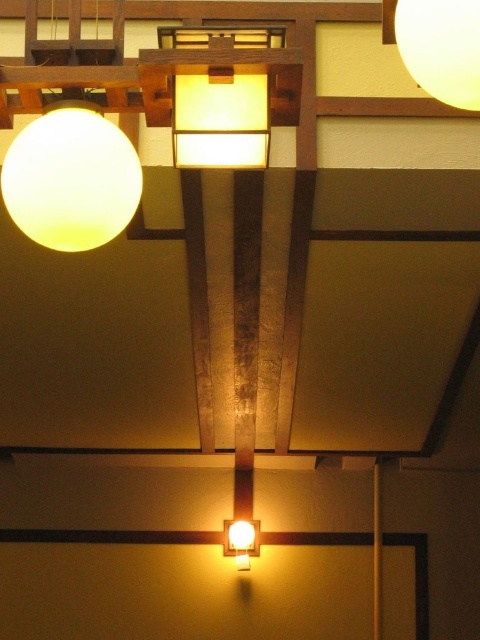
In the scene shown: Does matte wood panel at upper center have a smaller size compared to matte white sphere at upper right?

Incorrect, matte wood panel at upper center is not smaller in size than matte white sphere at upper right.

Does point (240, 106) come closer to viewer compared to point (452, 20)?

No, it is behind (452, 20).

Image resolution: width=480 pixels, height=640 pixels. I want to click on matte wood panel at upper center, so click(220, 122).

Between matte white sphere at upper left and matte white bulb at lower center, which one has more height?

matte white sphere at upper left

Where is `matte white sphere at upper left`? The width and height of the screenshot is (480, 640). matte white sphere at upper left is located at coordinates (71, 179).

Identify the location of matte white sphere at upper left. (71, 179).

Does matte white sphere at upper left have a larger size compared to matte white sphere at upper right?

Indeed, matte white sphere at upper left has a larger size compared to matte white sphere at upper right.

What do you see at coordinates (71, 179) in the screenshot?
I see `matte white sphere at upper left` at bounding box center [71, 179].

Find the location of a particular element. matte white sphere at upper left is located at coordinates (71, 179).